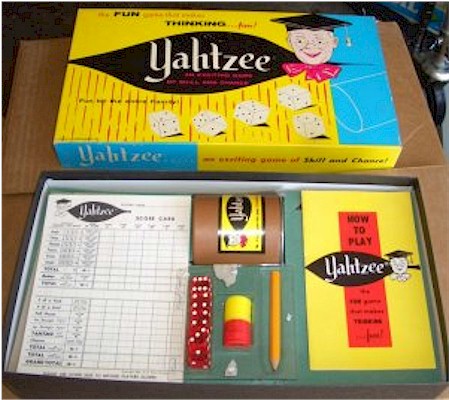
This screenshot has width=449, height=400. In order to click on game box in this screenshot , I will do `click(430, 388)`.